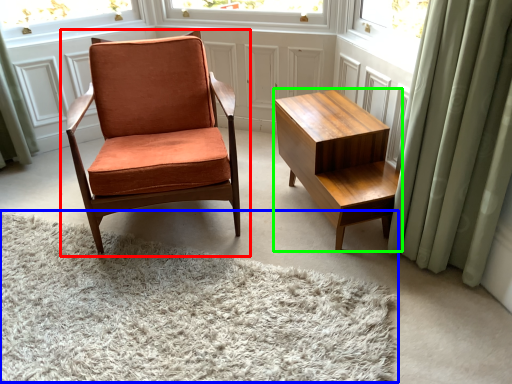
Question: Which is farther away from chair (highlighted by a red box)? plain (highlighted by a blue box) or table (highlighted by a green box)?

Choices:
 (A) plain
 (B) table

Answer: (A)